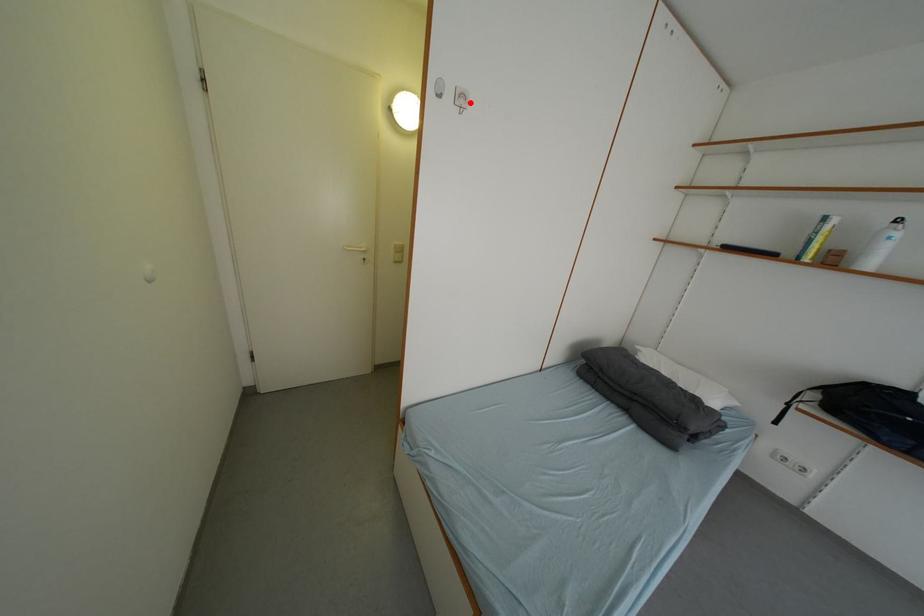
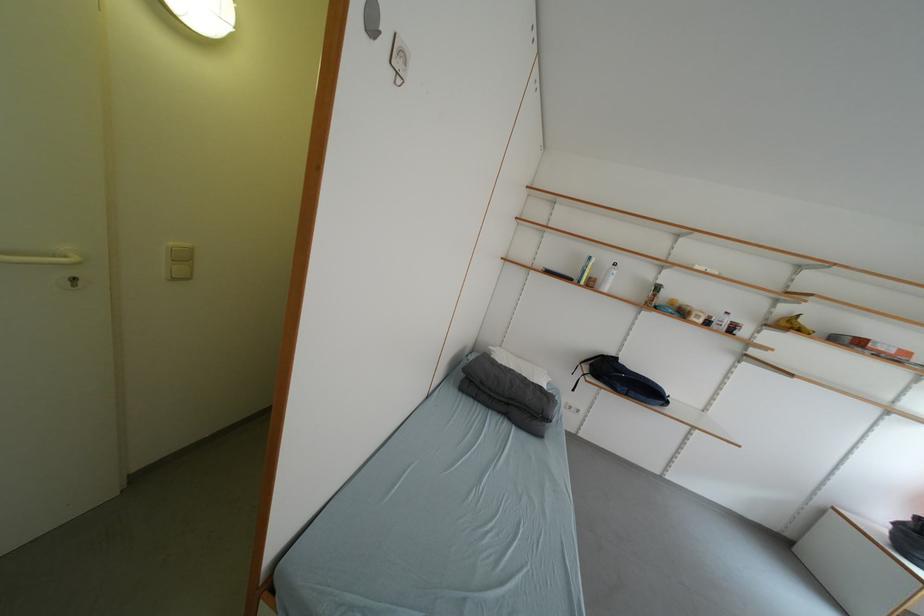
Where in the second image is the point corresponding to the highlighted location from the first image?

(407, 62)